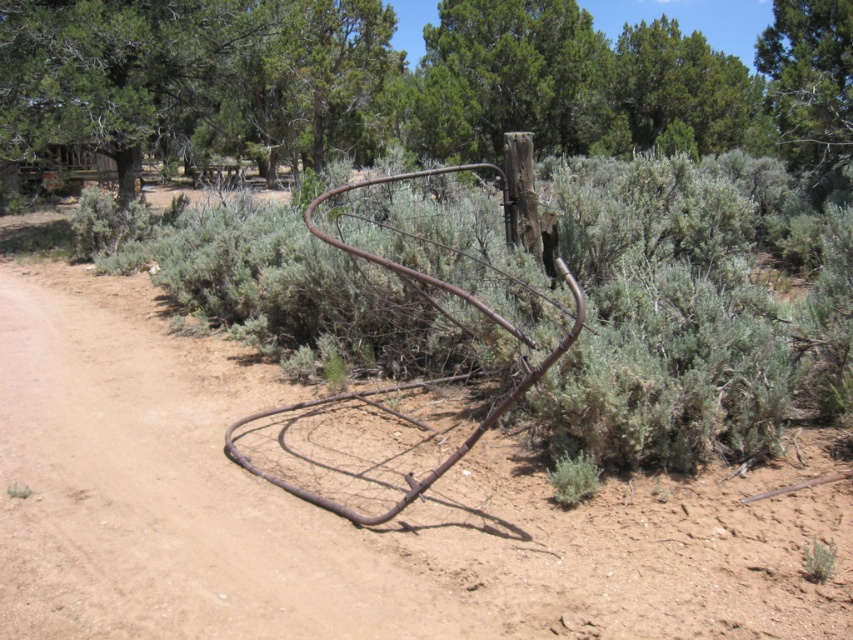
This screenshot has height=640, width=853. In order to click on brown dirt track at center in this screenshot , I will do `click(337, 516)`.

Who is more distant from viewer, (502, 568) or (161, 42)?

The point (161, 42) is behind.

Find the location of a particular element. This screenshot has height=640, width=853. brown dirt track at center is located at coordinates (337, 516).